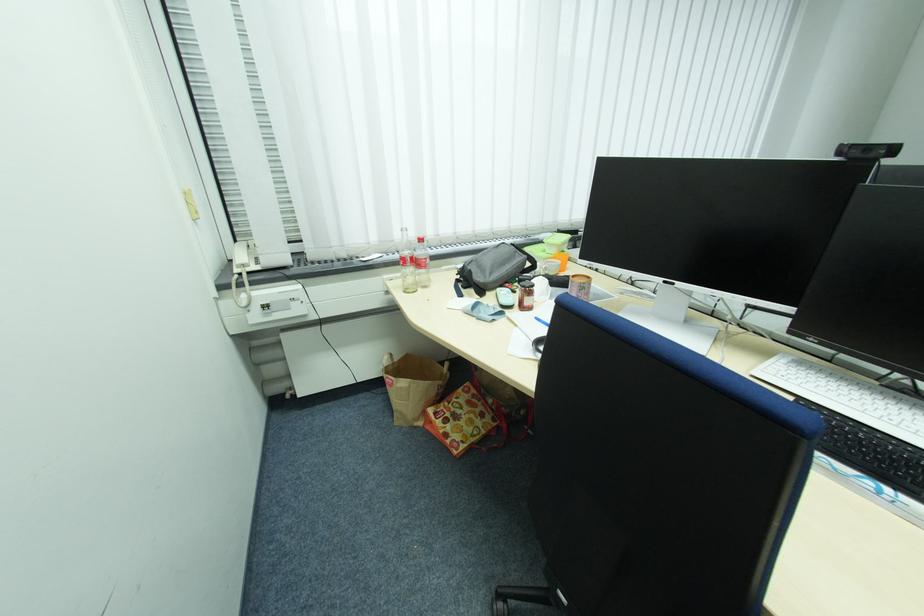
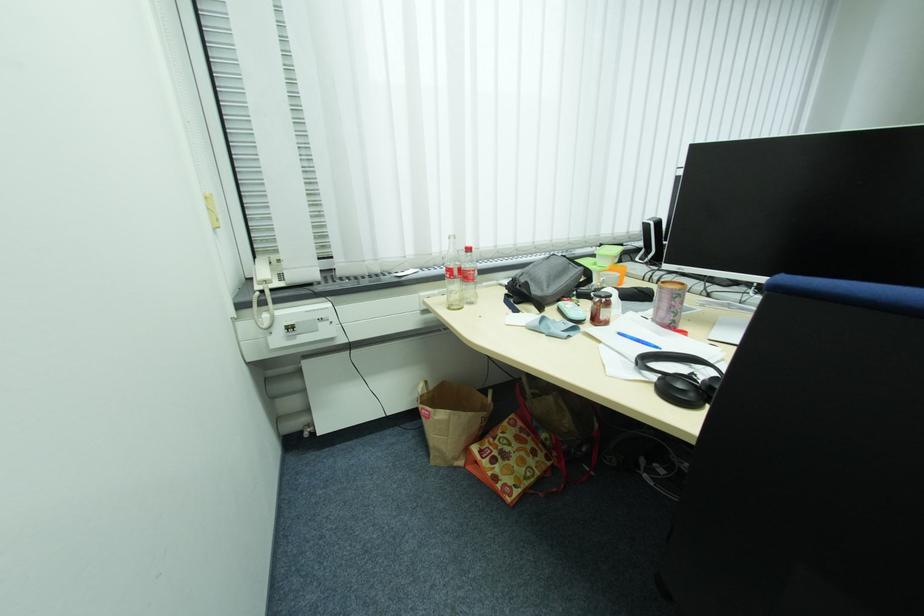
Question: I am providing you with two images of the same scene from different viewpoints. After the viewpoint changes to image2, which objects are now occluded?

Choices:
 (A) black headphones
 (B) light blue case
 (C) patterned cylindrical cup
 (D) none of these

Answer: (D)